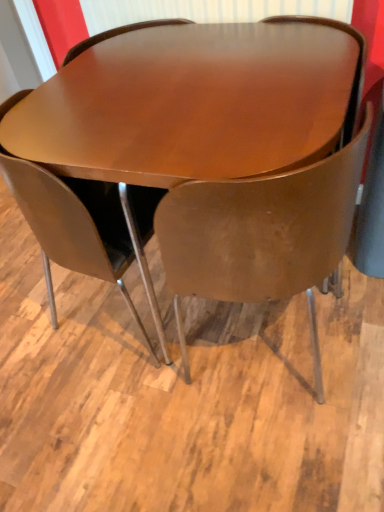
Question: From a real-world perspective, is matte brown chair at center, positioned as the 2th chair in right-to-left order, located higher than glossy wood table at center?

Choices:
 (A) yes
 (B) no

Answer: (A)

Question: Is matte brown chair at center, acting as the first chair starting from the left, outside glossy wood table at center?

Choices:
 (A) yes
 (B) no

Answer: (B)

Question: Is matte brown chair at center, positioned as the 2th chair in right-to-left order, bigger than glossy wood table at center?

Choices:
 (A) yes
 (B) no

Answer: (B)

Question: From the image's perspective, is matte brown chair at center, positioned as the 2th chair in right-to-left order, below glossy wood table at center?

Choices:
 (A) yes
 (B) no

Answer: (A)

Question: Is matte brown chair at center, acting as the first chair starting from the left, not close to glossy wood table at center?

Choices:
 (A) yes
 (B) no

Answer: (B)

Question: From a real-world perspective, is matte brown chair at center, acting as the first chair starting from the left, above or below matte brown chair at center, which ranks as the second chair in left-to-right order?

Choices:
 (A) below
 (B) above

Answer: (B)

Question: Considering the relative positions of matte brown chair at center, acting as the first chair starting from the left, and matte brown chair at center, the first chair in the right-to-left sequence, in the image provided, is matte brown chair at center, acting as the first chair starting from the left, to the left or to the right of matte brown chair at center, the first chair in the right-to-left sequence,?

Choices:
 (A) left
 (B) right

Answer: (A)

Question: Is matte brown chair at center, acting as the first chair starting from the left, in front of or behind matte brown chair at center, the first chair in the right-to-left sequence, in the image?

Choices:
 (A) behind
 (B) front

Answer: (A)

Question: From the image's perspective, is matte brown chair at center, positioned as the 2th chair in right-to-left order, above or below matte brown chair at center, the first chair in the right-to-left sequence?

Choices:
 (A) below
 (B) above

Answer: (B)

Question: Is matte brown chair at center, the first chair in the right-to-left sequence, taller or shorter than matte brown chair at center, positioned as the 2th chair in right-to-left order?

Choices:
 (A) short
 (B) tall

Answer: (B)

Question: Considering the positions of matte brown chair at center, the first chair in the right-to-left sequence, and matte brown chair at center, acting as the first chair starting from the left, in the image, is matte brown chair at center, the first chair in the right-to-left sequence, wider or thinner than matte brown chair at center, acting as the first chair starting from the left,?

Choices:
 (A) wide
 (B) thin

Answer: (A)

Question: Is matte brown chair at center, the first chair in the right-to-left sequence, in front of or behind matte brown chair at center, positioned as the 2th chair in right-to-left order, in the image?

Choices:
 (A) behind
 (B) front

Answer: (B)

Question: Considering the positions of point (289, 266) and point (102, 181), is point (289, 266) closer or farther from the camera than point (102, 181)?

Choices:
 (A) closer
 (B) farther

Answer: (A)

Question: Choose the correct answer: Is matte brown chair at center, the first chair in the right-to-left sequence, inside glossy wood table at center or outside it?

Choices:
 (A) inside
 (B) outside

Answer: (A)

Question: Is matte brown chair at center, the first chair in the right-to-left sequence, wider or thinner than glossy wood table at center?

Choices:
 (A) wide
 (B) thin

Answer: (B)